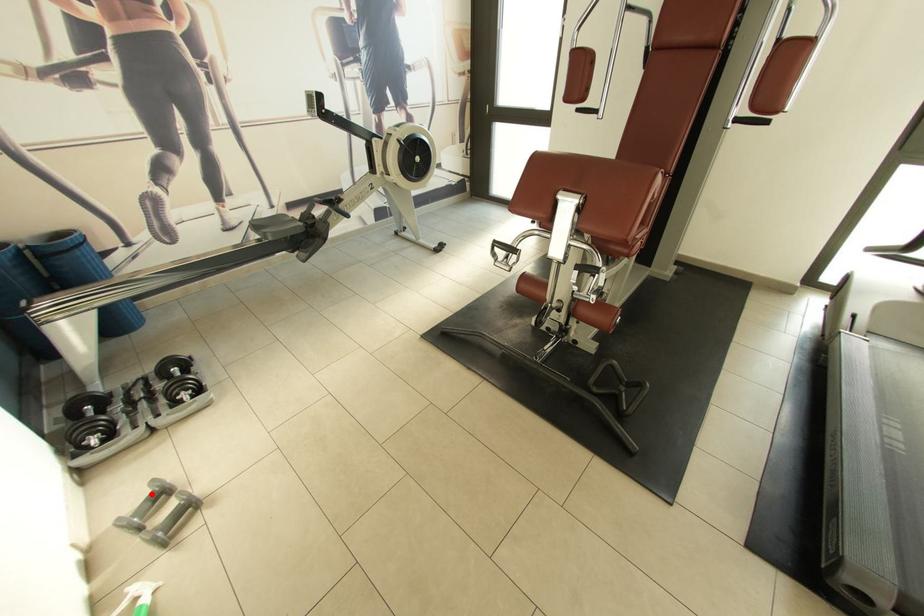
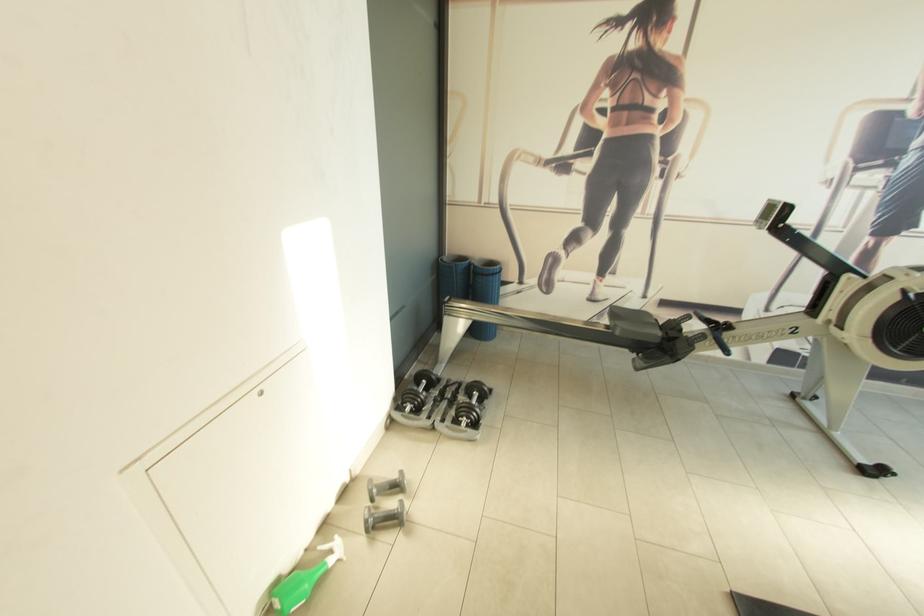
Question: A red point is marked in image1. In image2, is the corresponding 3D point closer to the camera or farther? Reply with the corresponding letter.

Choices:
 (A) The corresponding 3D point is closer.
 (B) The corresponding 3D point is farther.

Answer: (A)